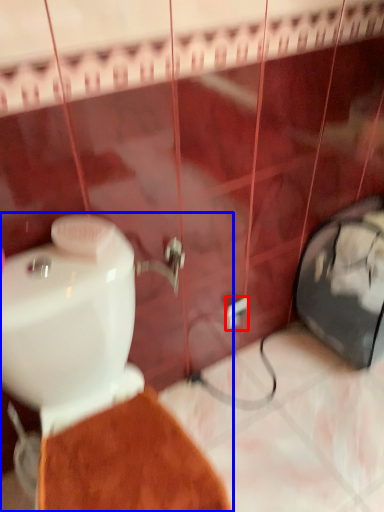
Question: Which point is further to the camera, electric outlet (highlighted by a red box) or toilet (highlighted by a blue box)?

Choices:
 (A) electric outlet
 (B) toilet

Answer: (A)